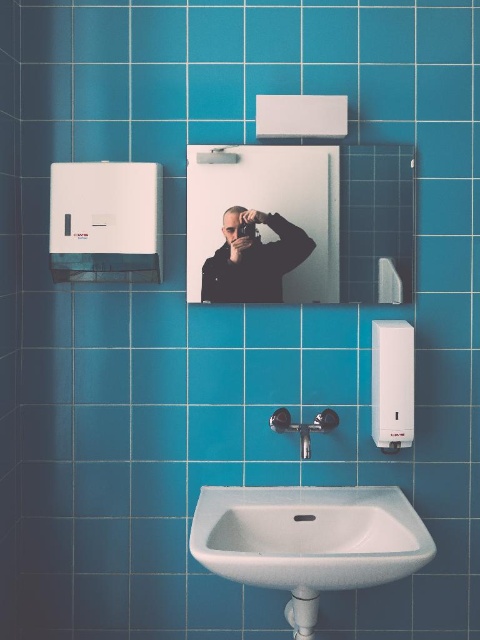
Who is positioned more to the right, clear glass mirror at upper center or satin nickel faucet at center?

satin nickel faucet at center

Who is more forward, (396, 292) or (321, 432)?

Positioned in front is point (321, 432).

Identify the location of clear glass mirror at upper center. (315, 214).

Who is higher up, black matte jacket at center or satin nickel faucet at center?

black matte jacket at center is above.

Can you confirm if black matte jacket at center is bigger than satin nickel faucet at center?

Incorrect, black matte jacket at center is not larger than satin nickel faucet at center.

Is point (262, 214) in front of point (276, 419)?

Yes, point (262, 214) is closer to viewer.

Find the location of a particular element. black matte jacket at center is located at coordinates [252, 259].

Consider the image. Can you confirm if white ceramic sink at center is positioned below black matte jacket at center?

Correct, white ceramic sink at center is located below black matte jacket at center.

Who is higher up, white ceramic sink at center or black matte jacket at center?

Positioned higher is black matte jacket at center.

The image size is (480, 640). I want to click on white ceramic sink at center, so click(309, 536).